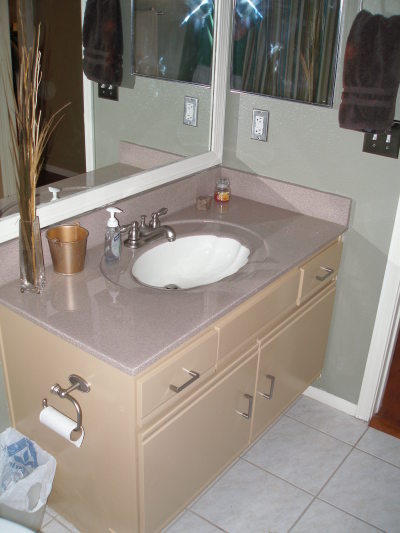
Locate an element on the screen. The width and height of the screenshot is (400, 533). doorway is located at coordinates (387, 365), (389, 294).